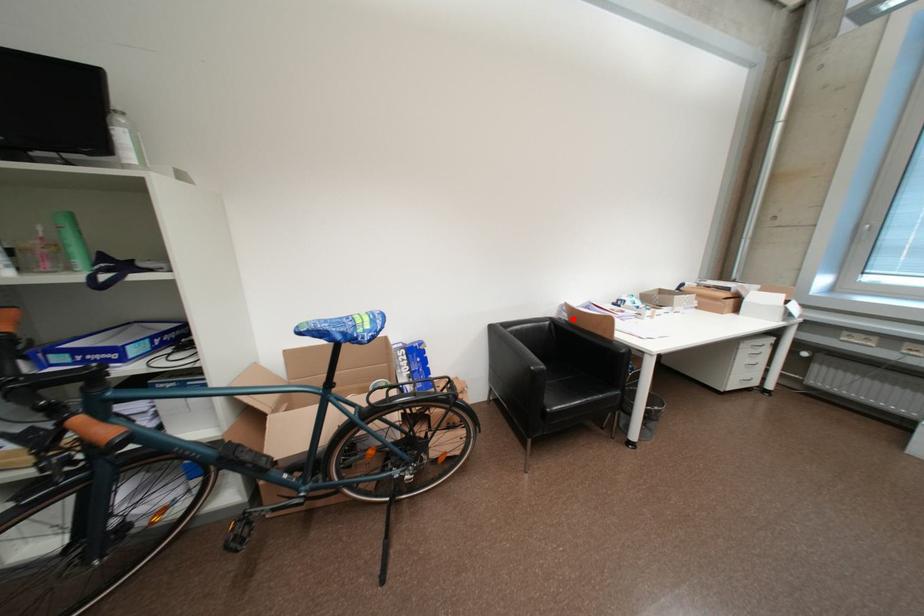
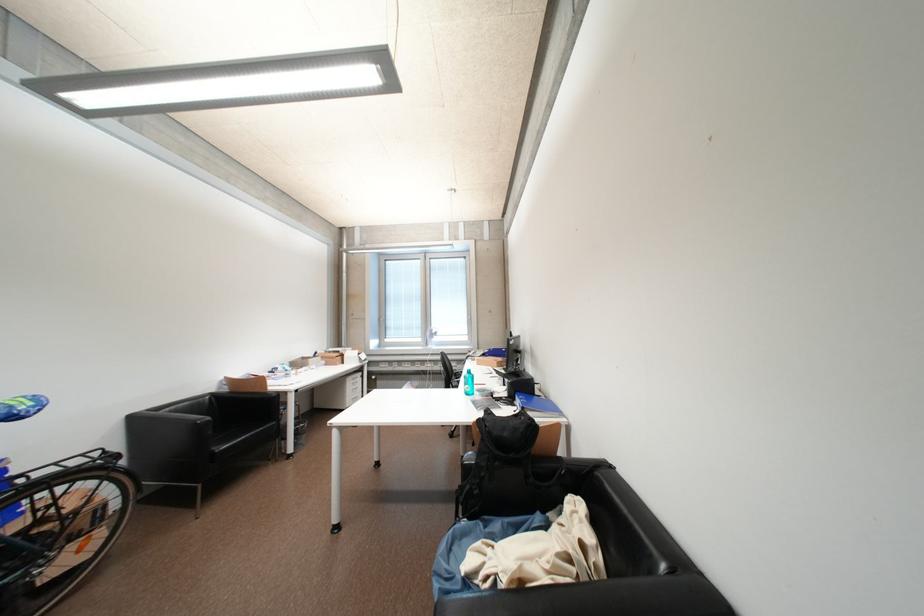
Question: I am providing you with two images of the same scene from different viewpoints. Image1 has a red point marked. In image2, the corresponding 3D location appears at what relative position? Reply with the corresponding letter.

Choices:
 (A) Closer
 (B) Farther

Answer: (B)